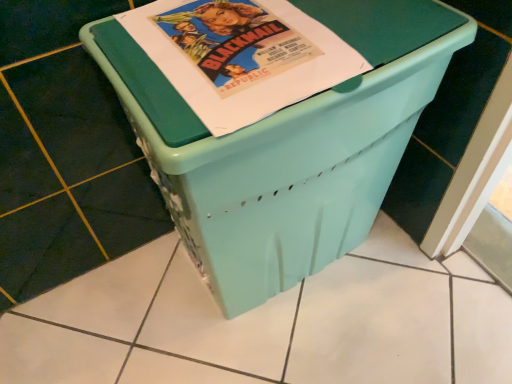
This screenshot has width=512, height=384. Find the location of `vacant area on top of mint plastic bin at center (from a real-world perspective)`. vacant area on top of mint plastic bin at center (from a real-world perspective) is located at coordinates (242, 38).